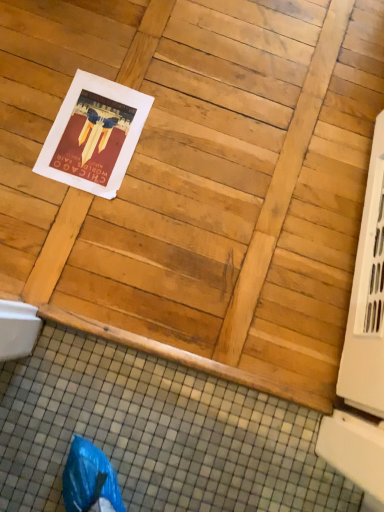
I want to click on vacant area to the left of white paper poster at upper left, so click(33, 98).